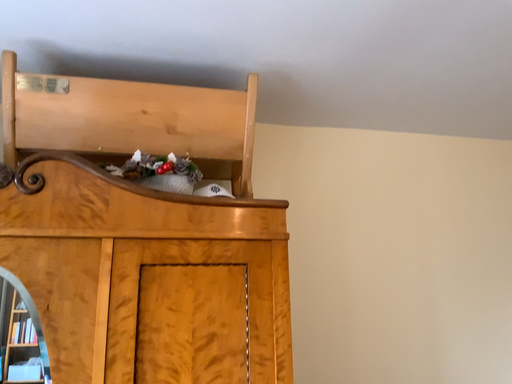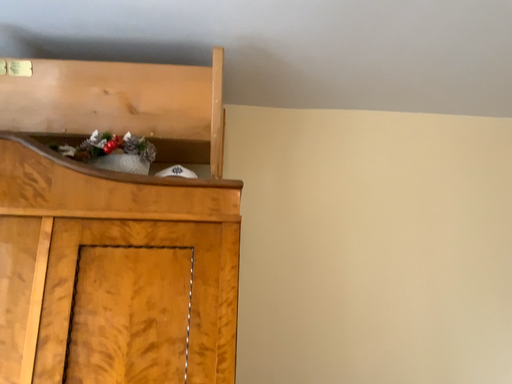
Question: Which way did the camera rotate in the video?

Choices:
 (A) rotated left
 (B) rotated right

Answer: (A)